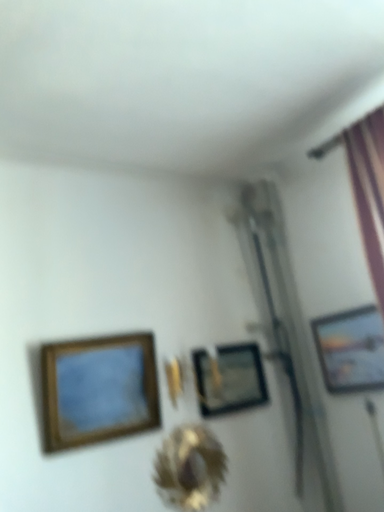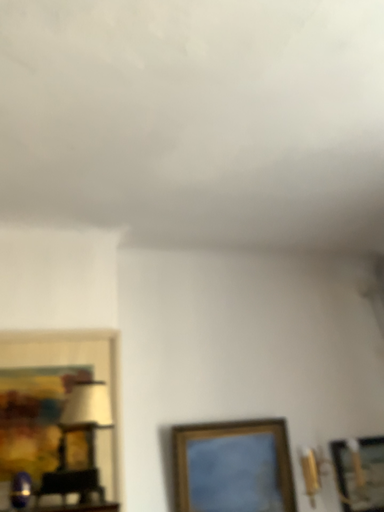
Question: Which way did the camera rotate in the video?

Choices:
 (A) rotated left
 (B) rotated right

Answer: (A)